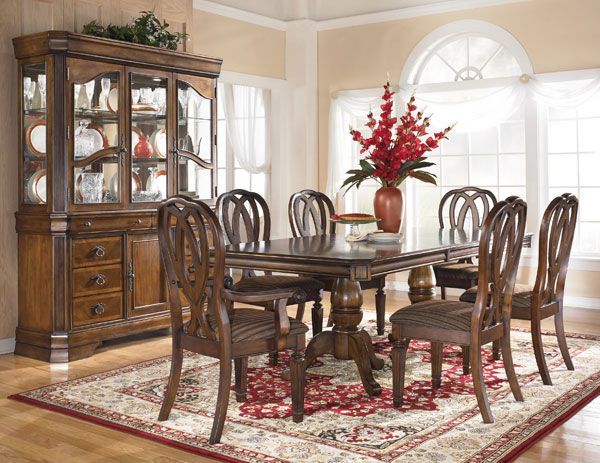
Find the location of a particular element. window is located at coordinates (575, 148), (510, 150), (359, 156), (469, 66).